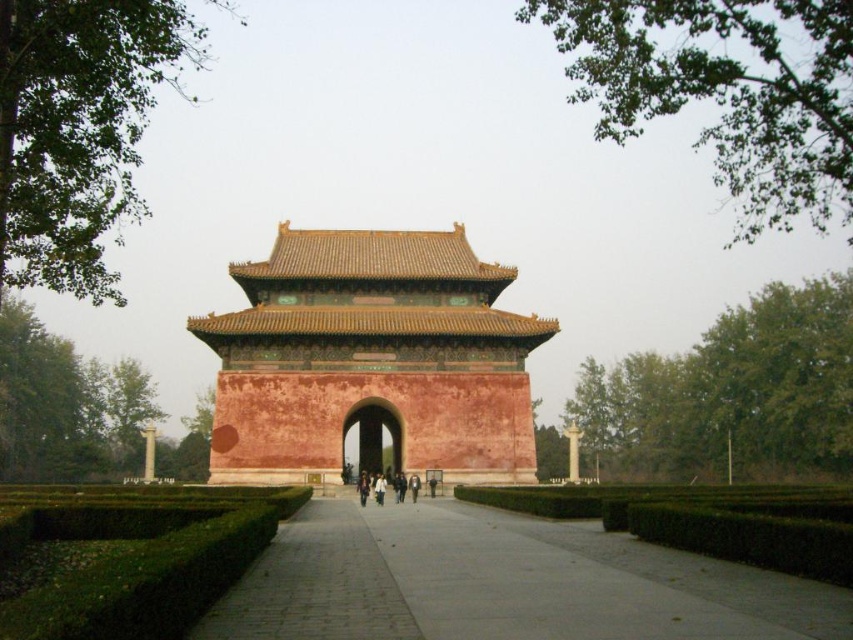
Is green hedge at center thinner than white matte jacket at center?

Incorrect, green hedge at center's width is not less than white matte jacket at center's.

Is point (705, 611) in front of point (381, 477)?

Yes, point (705, 611) is closer to viewer.

Does point (502, 609) come farther from viewer compared to point (386, 484)?

No, it is not.

You are a GUI agent. You are given a task and a screenshot of the screen. Output one action in this format:
    pyautogui.click(x=<x>, y=<y>)
    Task: Click on the green hedge at center
    This screenshot has height=640, width=853.
    Given the screenshot: What is the action you would take?
    pyautogui.click(x=502, y=582)

Does green hedge at center have a lesser width compared to brown leather jacket at center?

Incorrect, green hedge at center's width is not less than brown leather jacket at center's.

The width and height of the screenshot is (853, 640). What do you see at coordinates (502, 582) in the screenshot?
I see `green hedge at center` at bounding box center [502, 582].

Locate an element on the screen. This screenshot has height=640, width=853. green hedge at center is located at coordinates (502, 582).

Measure the distance from reddish-brown stone temple at center to green hedge at center.

A distance of 19.60 meters exists between reddish-brown stone temple at center and green hedge at center.

Does reddish-brown stone temple at center have a larger size compared to green hedge at center?

Yes.

Between point (216, 339) and point (404, 515), which one is positioned in front?

Point (404, 515) is more forward.

The width and height of the screenshot is (853, 640). In order to click on reddish-brown stone temple at center in this screenshot , I will do `click(370, 358)`.